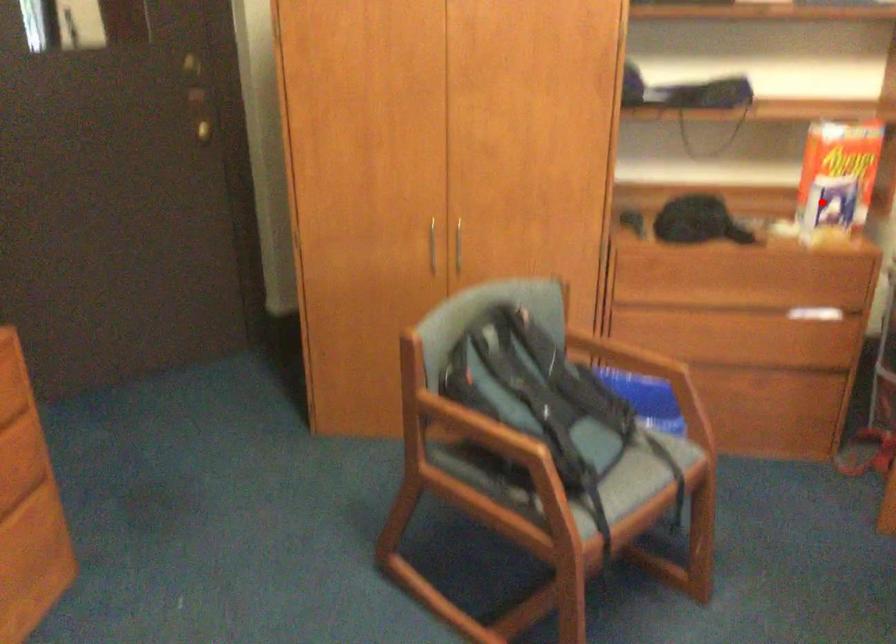
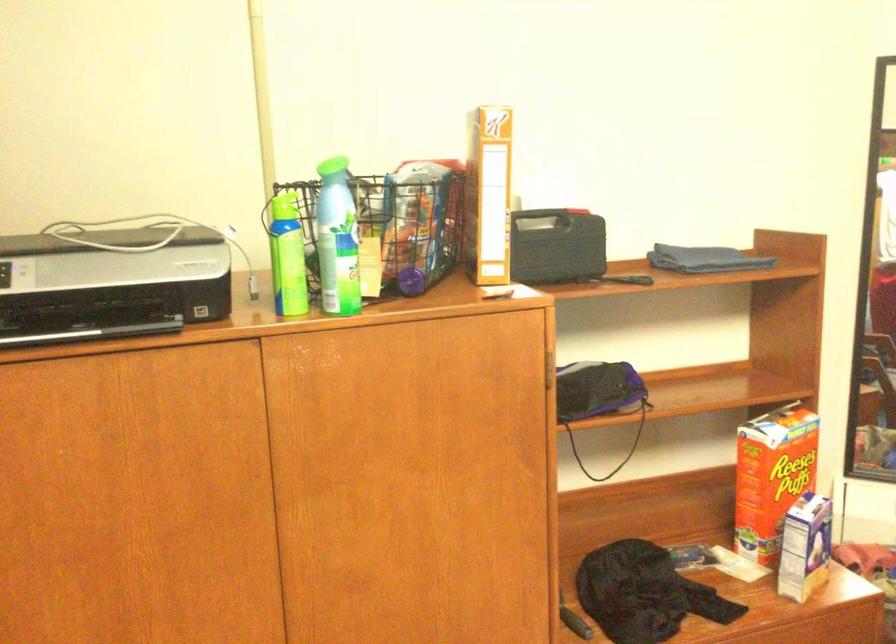
Question: I am providing you with two images of the same scene from different viewpoints. In image1, a red point is highlighted. Considering the same 3D point in image2, which of the following is correct?

Choices:
 (A) It is closer
 (B) It is farther

Answer: (A)